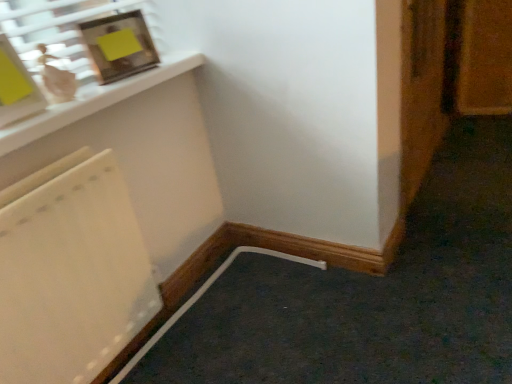
Question: Is wooden door at right surrounding metallic silver picture frame at upper left?

Choices:
 (A) no
 (B) yes

Answer: (A)

Question: Is wooden door at right facing towards metallic silver picture frame at upper left?

Choices:
 (A) yes
 (B) no

Answer: (B)

Question: Does wooden door at right have a smaller size compared to metallic silver picture frame at upper left?

Choices:
 (A) no
 (B) yes

Answer: (A)

Question: Considering the relative sizes of wooden door at right and metallic silver picture frame at upper left in the image provided, is wooden door at right bigger than metallic silver picture frame at upper left?

Choices:
 (A) no
 (B) yes

Answer: (B)

Question: Is wooden door at right closer to the viewer compared to metallic silver picture frame at upper left?

Choices:
 (A) no
 (B) yes

Answer: (A)

Question: From a real-world perspective, is wooden door at right below metallic silver picture frame at upper left?

Choices:
 (A) no
 (B) yes

Answer: (B)

Question: From a real-world perspective, does metallic silver picture frame at upper left stand above wooden door at right?

Choices:
 (A) no
 (B) yes

Answer: (B)

Question: Considering the relative sizes of metallic silver picture frame at upper left and wooden door at right in the image provided, is metallic silver picture frame at upper left wider than wooden door at right?

Choices:
 (A) no
 (B) yes

Answer: (A)

Question: Is metallic silver picture frame at upper left positioned in front of wooden door at right?

Choices:
 (A) yes
 (B) no

Answer: (A)

Question: Considering the relative positions of metallic silver picture frame at upper left and wooden door at right in the image provided, is metallic silver picture frame at upper left to the right of wooden door at right from the viewer's perspective?

Choices:
 (A) no
 (B) yes

Answer: (A)

Question: From a real-world perspective, does metallic silver picture frame at upper left sit lower than wooden door at right?

Choices:
 (A) yes
 (B) no

Answer: (B)

Question: Does metallic silver picture frame at upper left have a smaller size compared to wooden door at right?

Choices:
 (A) no
 (B) yes

Answer: (B)

Question: Considering the relative positions of wooden door at right and metallic silver picture frame at upper left in the image provided, is wooden door at right to the left or to the right of metallic silver picture frame at upper left?

Choices:
 (A) right
 (B) left

Answer: (A)